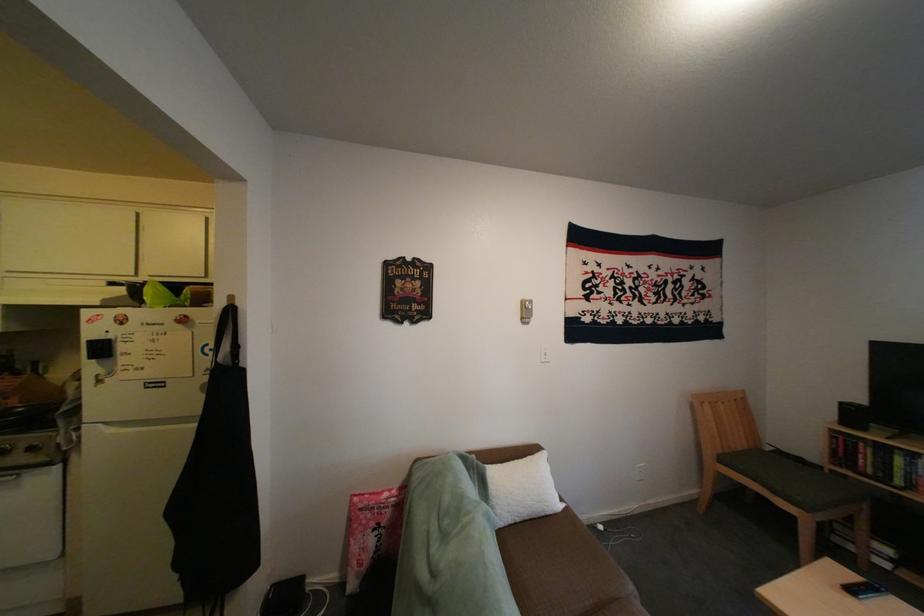
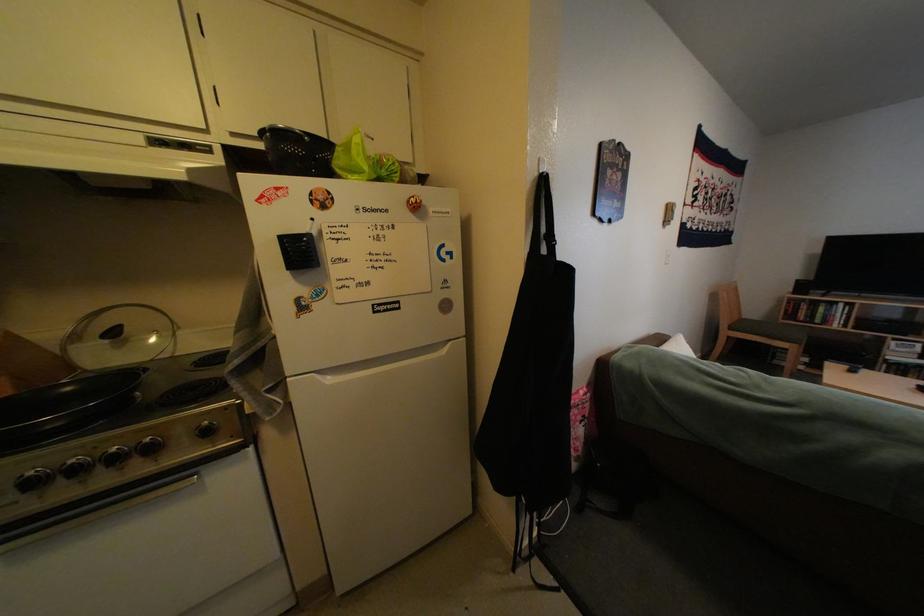
The point at (74,386) is marked in the first image. Where is the corresponding point in the second image?

(71, 353)